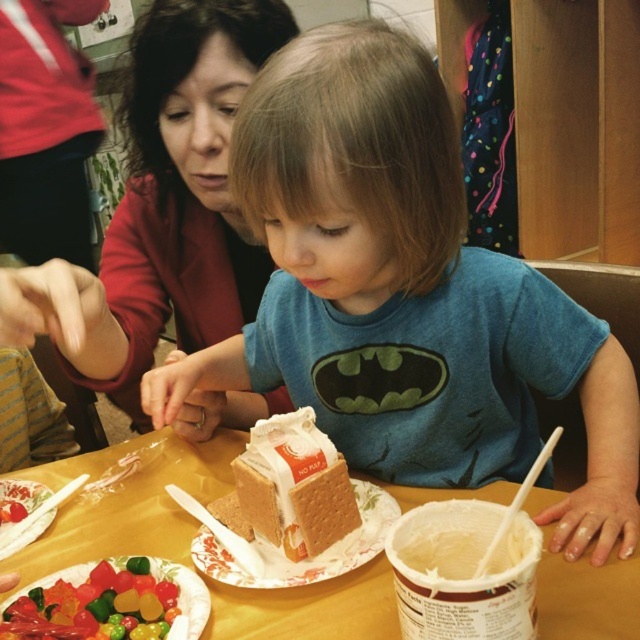
In the scene shown: Which of these two, matte red sweater at upper left or smooth cardboard table at center, stands taller?

matte red sweater at upper left

Between point (116, 272) and point (145, 525), which one is positioned in front?

Point (145, 525) is in front.

This screenshot has width=640, height=640. What do you see at coordinates (172, 200) in the screenshot?
I see `matte red sweater at upper left` at bounding box center [172, 200].

Where is `matte red sweater at upper left`? This screenshot has width=640, height=640. matte red sweater at upper left is located at coordinates (172, 200).

Between matte red sweater at upper left and caramel-golden cake at center, which one has more height?

Standing taller between the two is matte red sweater at upper left.

Is matte red sweater at upper left above caramel-golden cake at center?

Yes.

Who is more forward, (177, 225) or (300, 540)?

Point (300, 540) is more forward.

This screenshot has width=640, height=640. What are the coordinates of `matte red sweater at upper left` in the screenshot? It's located at (172, 200).

Who is positioned more to the right, matte red sweater at upper left or white paper plate at center?

From the viewer's perspective, white paper plate at center appears more on the right side.

In the scene shown: Can you confirm if matte red sweater at upper left is wider than white paper plate at center?

Indeed, matte red sweater at upper left has a greater width compared to white paper plate at center.

The image size is (640, 640). What are the coordinates of `matte red sweater at upper left` in the screenshot? It's located at (172, 200).